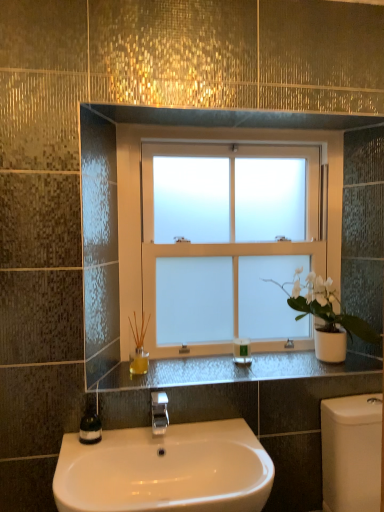
Question: Considering the relative positions of silver metallic faucet at center and green glass soap dispenser at lower left in the image provided, is silver metallic faucet at center to the left or to the right of green glass soap dispenser at lower left?

Choices:
 (A) left
 (B) right

Answer: (B)

Question: Is point (160, 403) closer or farther from the camera than point (94, 433)?

Choices:
 (A) farther
 (B) closer

Answer: (A)

Question: Estimate the real-world distances between objects in this image. Which object is closer to the silver metallic faucet at center?

Choices:
 (A) white glossy sink at lower center
 (B) frosted glass window at center
 (C) black granite counter at center
 (D) green plastic bottle at center
 (E) green glass soap dispenser at lower left

Answer: (A)

Question: Considering the real-world distances, which object is farthest from the frosted glass window at center?

Choices:
 (A) silver metallic faucet at center
 (B) white matte pot at right
 (C) green plastic bottle at center
 (D) black granite counter at center
 (E) green glass soap dispenser at lower left

Answer: (E)